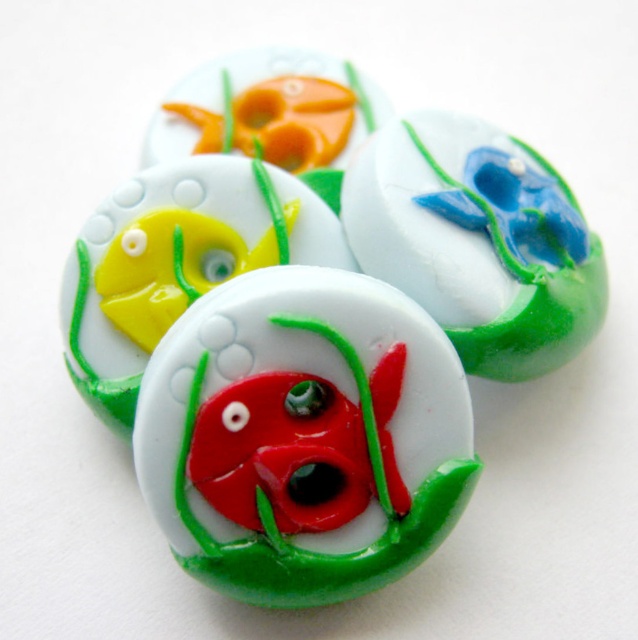
What is the object located at point (477, 241) in the image?

The object at point (477, 241) is the matte glass flower at upper right.

Consider the image. You are an interior designer arranging decorative buttons on a shelf. You have two buttons to place next to each other horizontally. One is the matte glass flower at upper right and the other is the matte glass fish at center. If you want to maintain their original relative positions as seen in the image, which button should be placed to the right side?

The matte glass flower at upper right should be placed to the right side because it was originally positioned on the right side of the matte glass fish at center in the image.